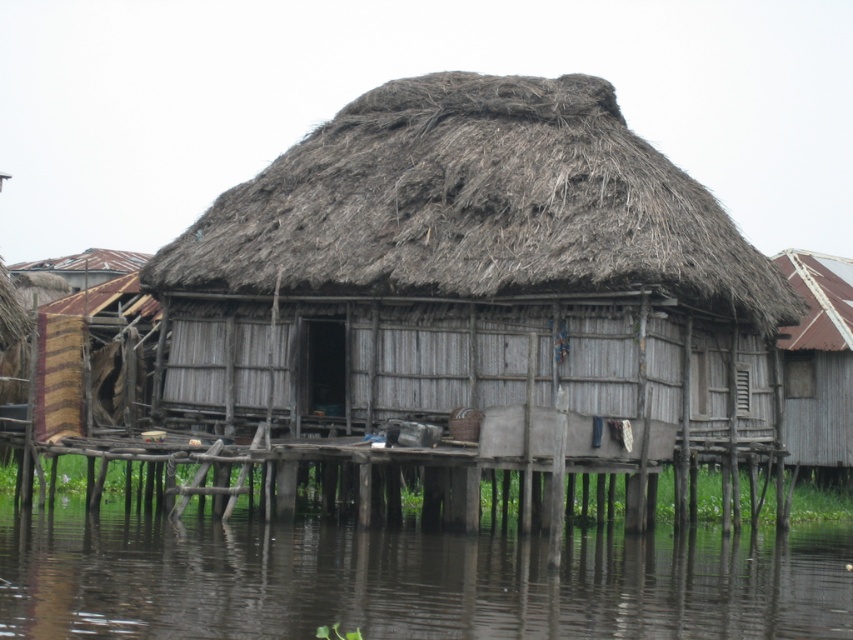
Question: Which object is closer to the camera taking this photo?

Choices:
 (A) striped fabric at left
 (B) wooden hut at right
 (C) red tile roof at upper right

Answer: (A)

Question: Which point appears closest to the camera in this image?

Choices:
 (A) (820, 426)
 (B) (817, 259)
 (C) (299, 525)

Answer: (C)

Question: Which point is closer to the camera?

Choices:
 (A) (653, 588)
 (B) (598, 273)

Answer: (A)

Question: Does dark brown water at lower center appear on the left side of striped fabric at left?

Choices:
 (A) yes
 (B) no

Answer: (B)

Question: Does dark brown water at lower center appear on the right side of red tile roof at upper right?

Choices:
 (A) yes
 (B) no

Answer: (B)

Question: Does brown thatch at center lie behind striped fabric at left?

Choices:
 (A) yes
 (B) no

Answer: (B)